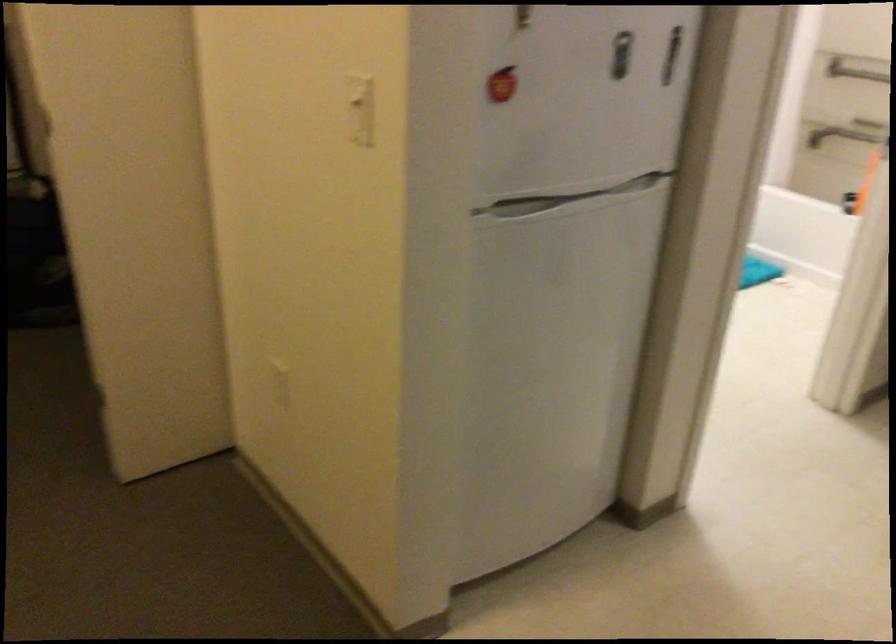
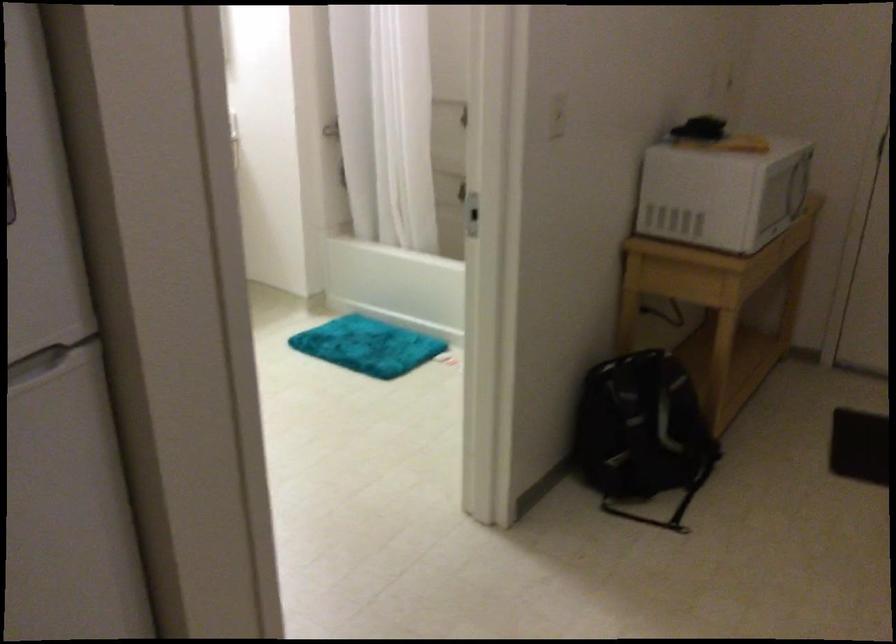
In a continuous first-person perspective shot, in which direction is the camera moving?

The cameraman moved toward right, forward.